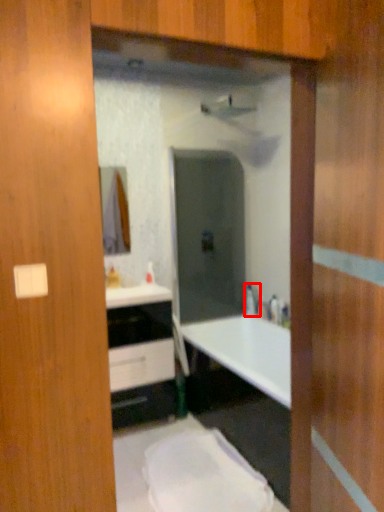
Question: From the image, what is the correct spatial relationship of faucet (annotated by the red box) in relation to bathroom cabinet?

Choices:
 (A) right
 (B) left

Answer: (A)